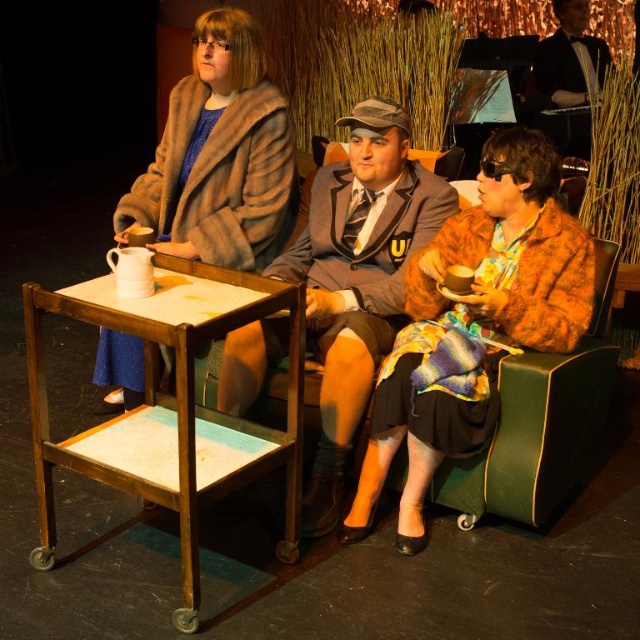
What are the coordinates of `brown wooden table at center` in the screenshot? It's located at (170, 406).

Does brown wooden table at center have a greater width compared to matte gray suit at center?

No.

Identify the location of brown wooden table at center. The width and height of the screenshot is (640, 640). (170, 406).

At what (x,y) coordinates should I click in order to perform the action: click on brown wooden table at center. Please return your answer as a coordinate pair (x, y). The height and width of the screenshot is (640, 640). Looking at the image, I should click on (170, 406).

Measure the distance between point (333, 348) and camera.

The distance of point (333, 348) from camera is 2.39 meters.

Measure the distance from matte gray suit at center to velvet green armchair at right.

matte gray suit at center and velvet green armchair at right are 28.15 inches apart.

Describe the element at coordinates (356, 276) in the screenshot. The image size is (640, 640). I see `matte gray suit at center` at that location.

Locate an element on the screen. Image resolution: width=640 pixels, height=640 pixels. matte gray suit at center is located at coordinates (356, 276).

Does brown wooden table at center have a lesser height compared to fur coat at upper left?

No.

Which is in front, point (196, 544) or point (241, 236)?

Point (196, 544)

Image resolution: width=640 pixels, height=640 pixels. I want to click on brown wooden table at center, so click(170, 406).